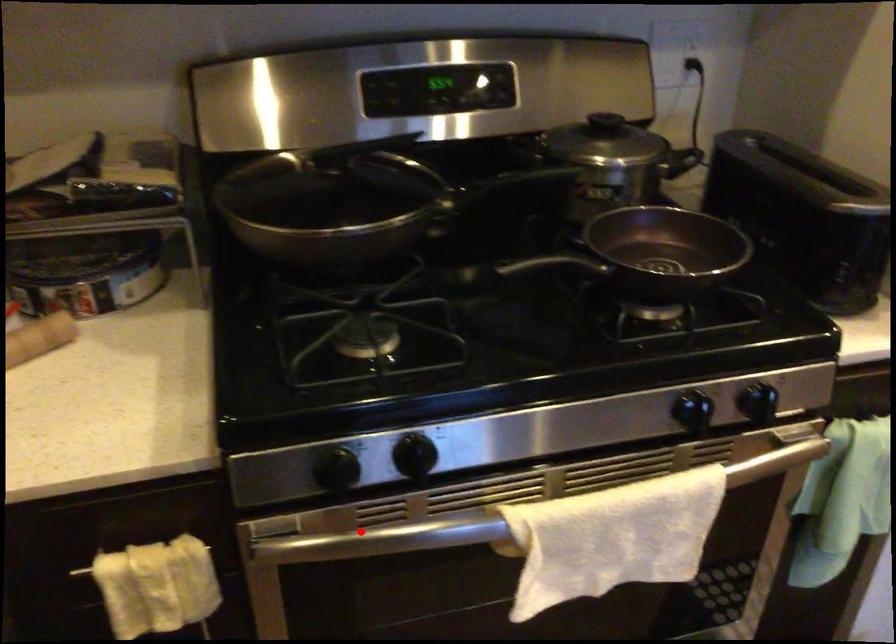
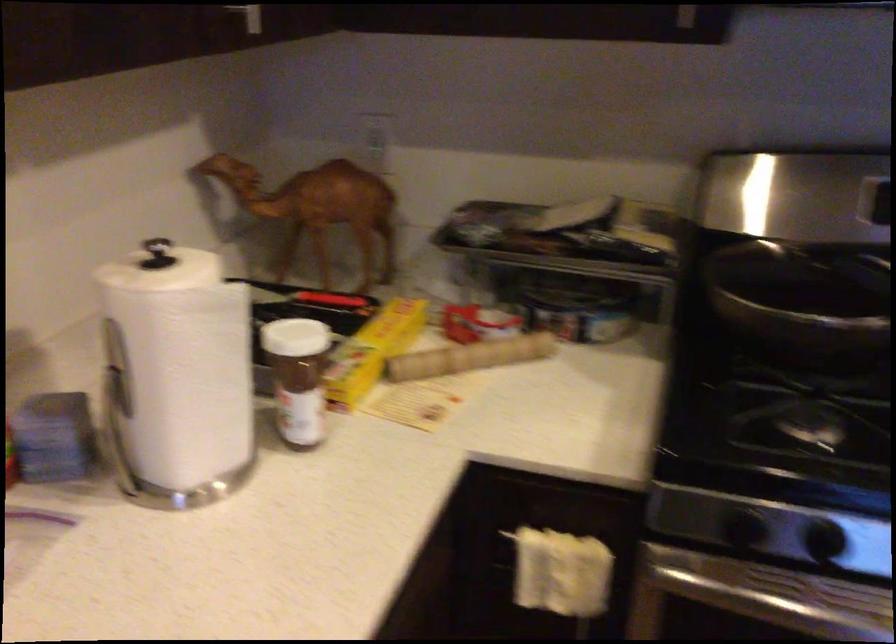
Locate, in the second image, the point that corresponds to the highlighted location in the first image.

(756, 596)